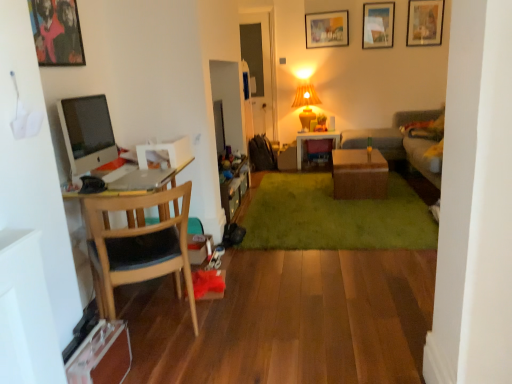
Where is `free location to the right of wooden chair at left`? free location to the right of wooden chair at left is located at coordinates (239, 331).